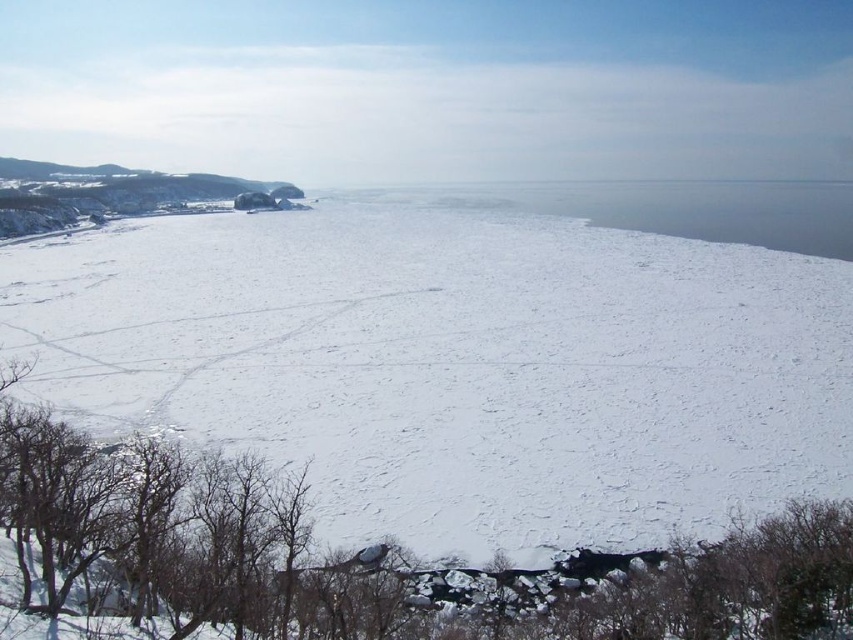
Question: Can you confirm if white matte snow at center is positioned to the left of transparent ice at center?

Choices:
 (A) yes
 (B) no

Answer: (A)

Question: Is white matte snow at center to the left of transparent ice at center from the viewer's perspective?

Choices:
 (A) no
 (B) yes

Answer: (B)

Question: Which point is closer to the camera taking this photo?

Choices:
 (A) (698, 461)
 (B) (572, 189)

Answer: (A)

Question: Which point is farther to the camera?

Choices:
 (A) transparent ice at center
 (B) white matte snow at center

Answer: (A)

Question: Which point is farther to the camera?

Choices:
 (A) (784, 248)
 (B) (581, 336)

Answer: (A)

Question: Is the position of white matte snow at center more distant than that of transparent ice at center?

Choices:
 (A) yes
 (B) no

Answer: (B)